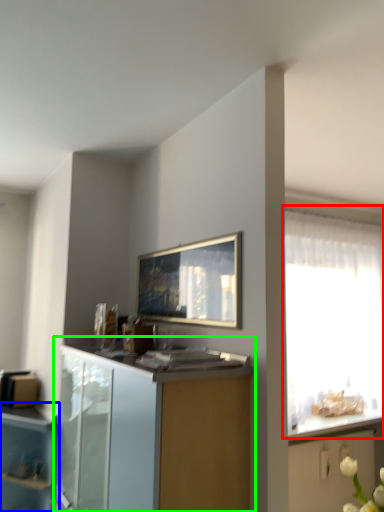
Question: Estimate the real-world distances between objects in this image. Which object is farther from window (highlighted by a red box), cupboard (highlighted by a blue box) or cabinetry (highlighted by a green box)?

Choices:
 (A) cupboard
 (B) cabinetry

Answer: (A)